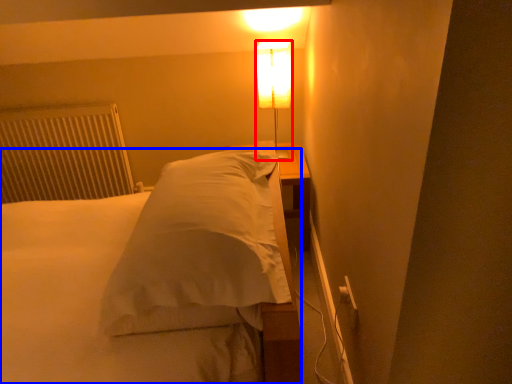
Question: Which object is closer to the camera taking this photo, lamp (highlighted by a red box) or bed (highlighted by a blue box)?

Choices:
 (A) lamp
 (B) bed

Answer: (B)